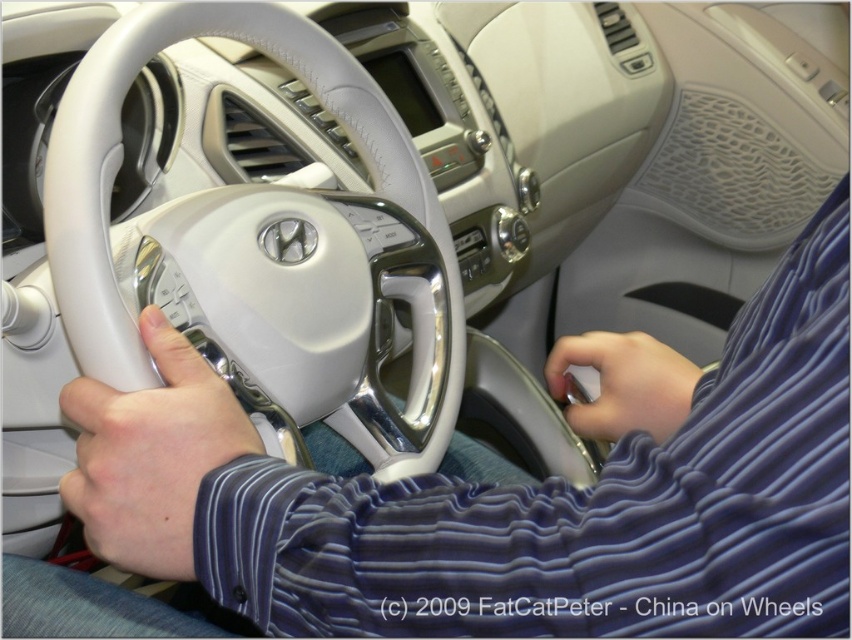
Question: Estimate the real-world distances between objects in this image. Which object is closer to the white leather shirt at center?

Choices:
 (A) satin blue sleeve at lower right
 (B) white leather steering wheel at center

Answer: (A)

Question: Is white leather steering wheel at center bigger than matte white steering wheel at center?

Choices:
 (A) yes
 (B) no

Answer: (A)

Question: Which point is closer to the camera taking this photo?

Choices:
 (A) [556, 376]
 (B) [96, 92]
 (C) [165, 547]
 (D) [153, 339]

Answer: (C)

Question: Considering the relative positions of white leather steering wheel at center and satin blue sleeve at lower right in the image provided, where is white leather steering wheel at center located with respect to satin blue sleeve at lower right?

Choices:
 (A) below
 (B) above

Answer: (B)

Question: Considering the real-world distances, which object is closest to the white leather steering wheel at center?

Choices:
 (A) white leather shirt at center
 (B) satin blue sleeve at lower right

Answer: (A)

Question: Is white leather shirt at center closer to camera compared to white leather steering wheel at center?

Choices:
 (A) no
 (B) yes

Answer: (B)